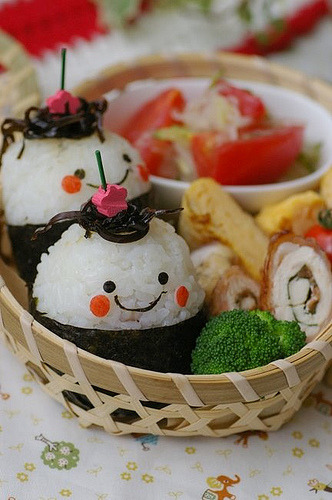
Where is `basket`? The image size is (332, 500). basket is located at coordinates (152, 389).